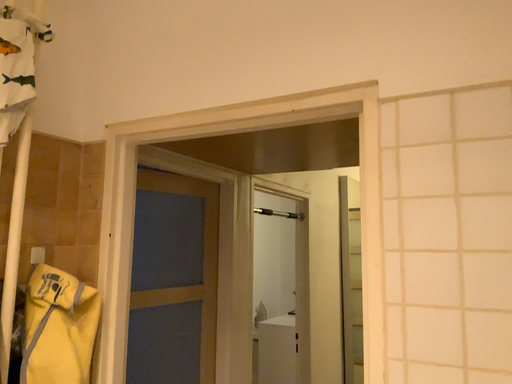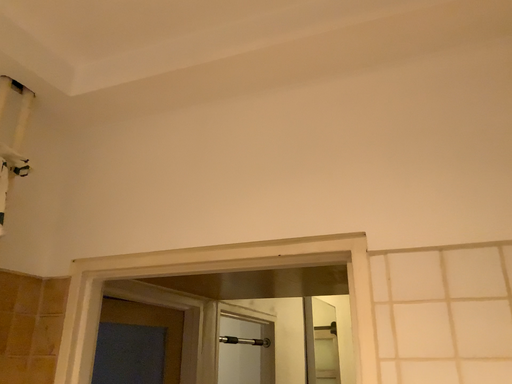
Question: Which way did the camera rotate in the video?

Choices:
 (A) rotated right
 (B) rotated left

Answer: (A)